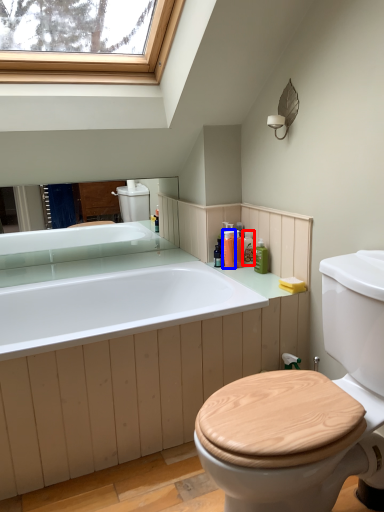
Question: Which of the following is the closest to the observer, toiletry (highlighted by a red box) or toiletry (highlighted by a blue box)?

Choices:
 (A) toiletry
 (B) toiletry

Answer: (B)